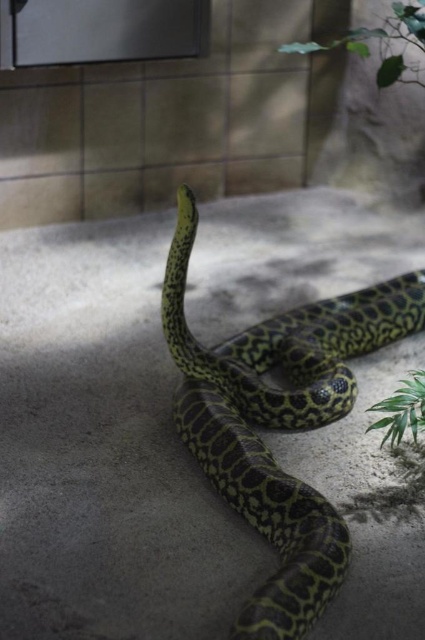
Question: Which of the following is the closest to the observer?

Choices:
 (A) (388, 56)
 (B) (382, 422)
 (C) (214, 456)

Answer: (B)

Question: Which object appears closest to the camera in this image?

Choices:
 (A) green textured snake at center
 (B) green leafy plant at upper right

Answer: (A)

Question: Can you confirm if green textured snake at center is positioned above green leafy plant at upper right?

Choices:
 (A) no
 (B) yes

Answer: (A)

Question: Is the position of green textured snake at center less distant than that of green leafy plant at upper right?

Choices:
 (A) no
 (B) yes

Answer: (B)

Question: Is green textured snake at center to the left of green leafy plant at lower right from the viewer's perspective?

Choices:
 (A) no
 (B) yes

Answer: (B)

Question: Among these objects, which one is farthest from the camera?

Choices:
 (A) green leafy plant at upper right
 (B) green textured snake at center
 (C) green leafy plant at lower right

Answer: (C)